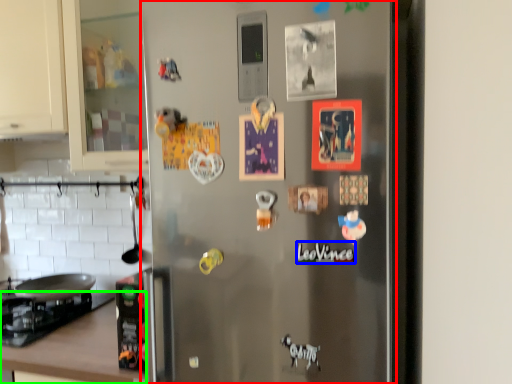
Question: Estimate the real-world distances between objects in this image. Which object is closer to refrigerator (highlighted by a red box), writing (highlighted by a blue box) or counter top (highlighted by a green box)?

Choices:
 (A) writing
 (B) counter top

Answer: (A)